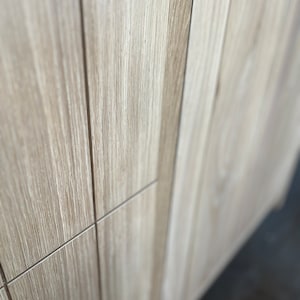
You are a GUI agent. You are given a task and a screenshot of the screen. Output one action in this format:
    pyautogui.click(x=<x>, y=<y>)
    Task: Click on the groove between the first two boards on the top row
    The height and width of the screenshot is (300, 300).
    Given the screenshot: What is the action you would take?
    pyautogui.click(x=4, y=279)